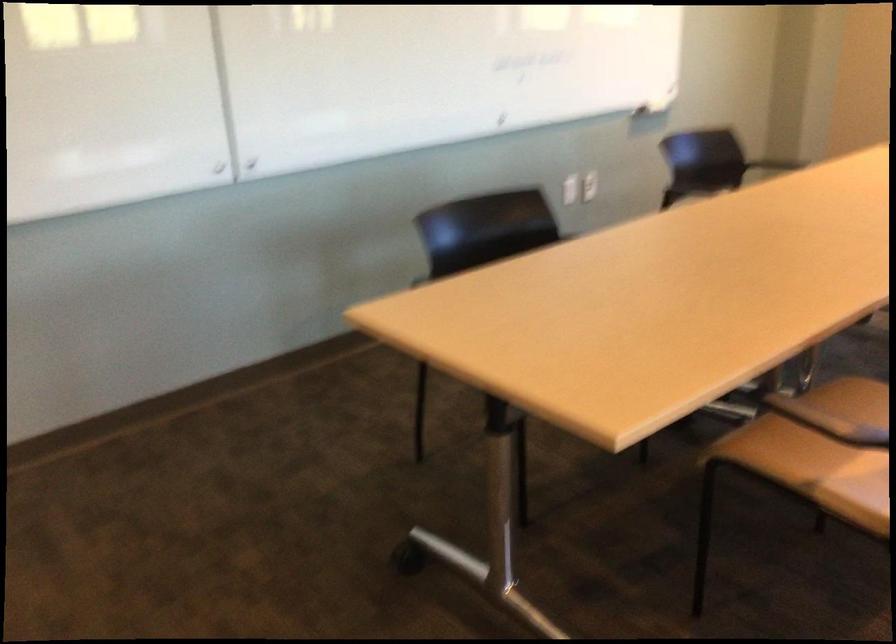
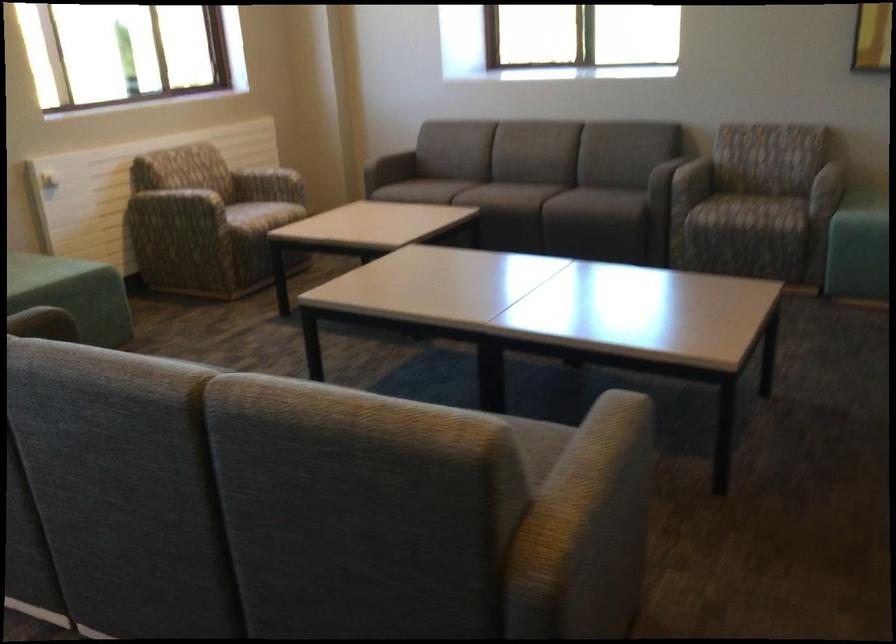
Based on the continuous images, in which direction is the camera rotating?

The camera rotated toward right-down.